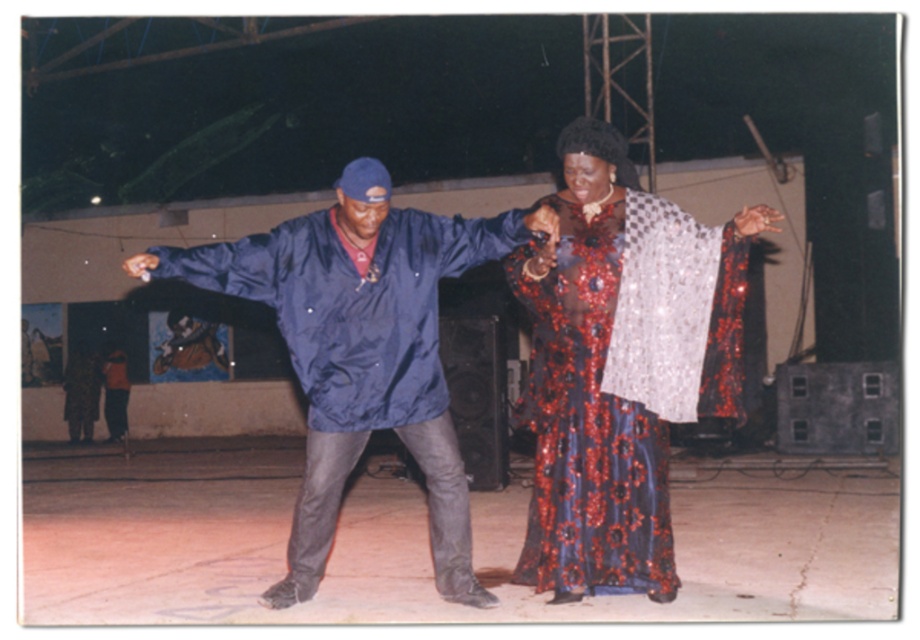
You are standing at the point with coordinates point (76, 346) and want to move towards the point with coordinates point (302, 237). Based on the scene description, will you be moving forward or backward?

Since point (302, 237) is in front of point (76, 346), moving towards it would mean moving forward.